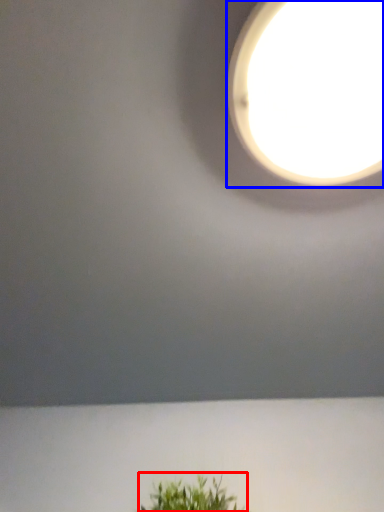
Question: Which object is further to the camera taking this photo, houseplant (highlighted by a red box) or lamp (highlighted by a blue box)?

Choices:
 (A) houseplant
 (B) lamp

Answer: (A)